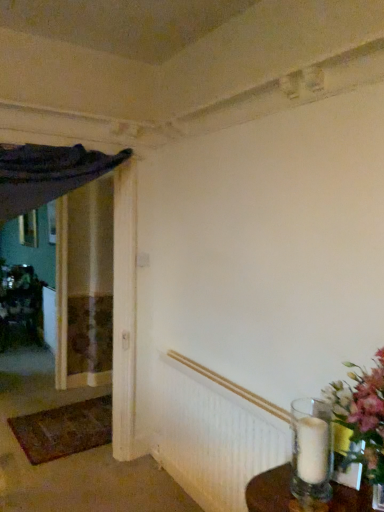
The height and width of the screenshot is (512, 384). What are the coordinates of `free spot above white textured radiator at lower right (from a real-world perspective)` in the screenshot? It's located at (235, 382).